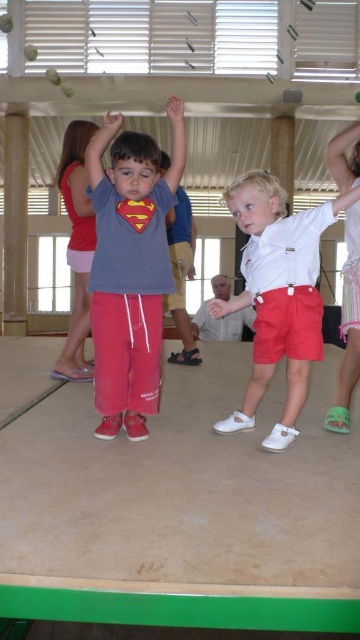
Describe the element at coordinates (129, 269) in the screenshot. I see `matte gray shirt at center` at that location.

Does point (136, 435) come closer to viewer compared to point (290, 376)?

No, (136, 435) is behind (290, 376).

This screenshot has height=640, width=360. What are the coordinates of `matte gray shirt at center` in the screenshot? It's located at (129, 269).